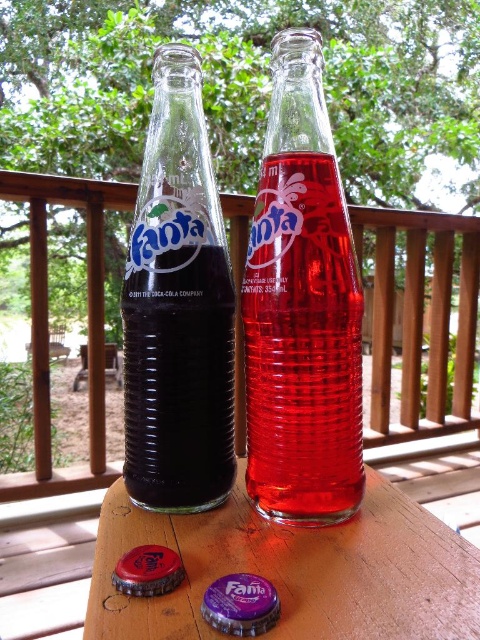
Between point (190, 403) and point (115, 356), which one is positioned behind?

The point (115, 356) is behind.

Which of these two, matte glass bottle at left or wooden picnic table at center, stands taller?

Standing taller between the two is matte glass bottle at left.

Measure the distance between matte glass bottle at left and camera.

10.19 inches

This screenshot has height=640, width=480. Identify the location of matte glass bottle at left. (178, 308).

Describe the element at coordinates (301, 308) in the screenshot. I see `translucent glass bottle at center` at that location.

Is translucent glass bottle at center taller than brushed metal bottle cap at lower left?

Yes.

From the picture: Who is more distant from viewer, (251, 250) or (146, 580)?

The point (251, 250) is more distant.

Image resolution: width=480 pixels, height=640 pixels. I want to click on translucent glass bottle at center, so click(301, 308).

Can you confirm if matte glass bottle at left is positioned to the right of brushed metal bottle cap at lower left?

In fact, matte glass bottle at left is to the left of brushed metal bottle cap at lower left.

Describe the element at coordinates (178, 308) in the screenshot. Image resolution: width=480 pixels, height=640 pixels. I see `matte glass bottle at left` at that location.

Who is more forward, (141, 506) or (120, 572)?

Point (120, 572)

Identify the location of matte glass bottle at left. This screenshot has height=640, width=480. (178, 308).